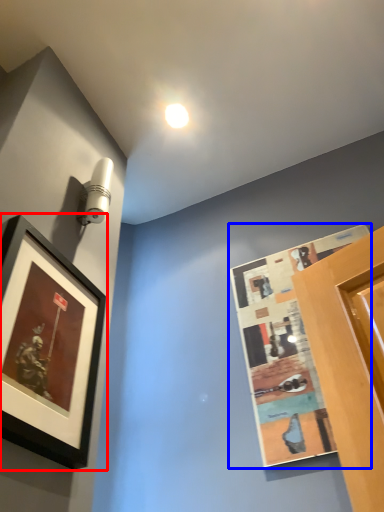
Question: Which of the following is the farthest to the observer, picture frame (highlighted by a red box) or picture frame (highlighted by a blue box)?

Choices:
 (A) picture frame
 (B) picture frame

Answer: (B)